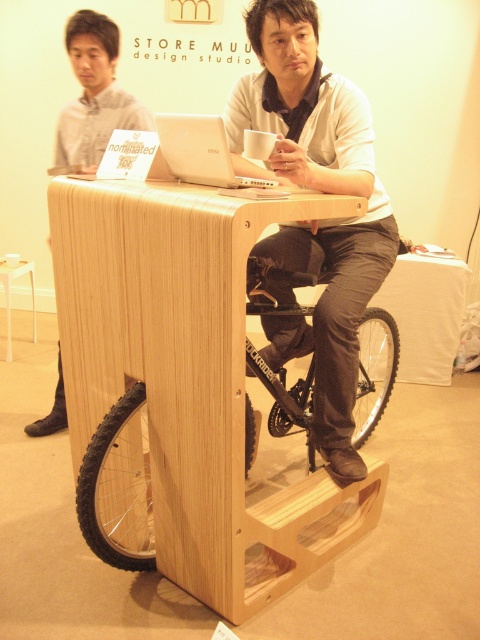
Question: Can you confirm if white wood stool at lower left is bigger than white matte cup at center?

Choices:
 (A) yes
 (B) no

Answer: (A)

Question: Among these points, which one is nearest to the camera?

Choices:
 (A) (180, 163)
 (B) (346, 176)
 (C) (32, 262)

Answer: (A)

Question: Is light wood table at center further to camera compared to white wood stool at lower left?

Choices:
 (A) yes
 (B) no

Answer: (B)

Question: Can you confirm if matte wood bike at center is smaller than white matte laptop at center?

Choices:
 (A) no
 (B) yes

Answer: (A)

Question: Which point is closer to the camera taking this photo?

Choices:
 (A) (240, 186)
 (B) (96, 352)

Answer: (A)

Question: Among these points, which one is farthest from the camera?

Choices:
 (A) (0, 260)
 (B) (194, 428)

Answer: (A)